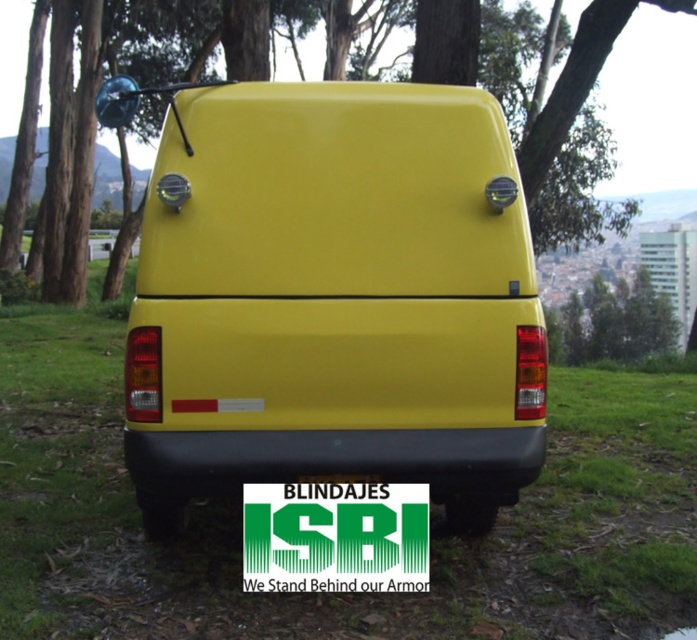
Question: Among these points, which one is nearest to the camera?

Choices:
 (A) (183, 468)
 (B) (76, 442)
 (C) (247, 502)
 (D) (648, 38)

Answer: (A)

Question: Can you confirm if matte yellow van at center is positioned below green matte tree at upper center?

Choices:
 (A) no
 (B) yes

Answer: (B)

Question: Estimate the real-world distances between objects in this image. Which object is closer to the green matte sign at center?

Choices:
 (A) green matte tree at upper center
 (B) green grass at center

Answer: (B)

Question: From the image, what is the correct spatial relationship of matte yellow van at center in relation to green grass at center?

Choices:
 (A) above
 (B) below

Answer: (A)

Question: Estimate the real-world distances between objects in this image. Which object is closer to the green matte tree at upper center?

Choices:
 (A) matte yellow van at center
 (B) green matte sign at center

Answer: (A)

Question: In this image, where is matte yellow van at center located relative to green matte sign at center?

Choices:
 (A) below
 (B) above

Answer: (B)